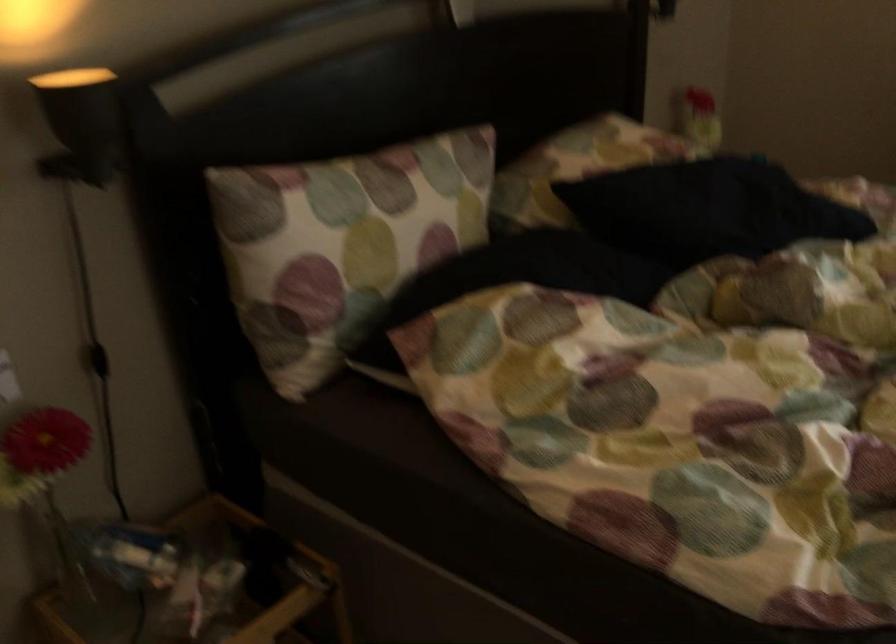
Find the location of a particular element. glass flower vase is located at coordinates (46, 480).